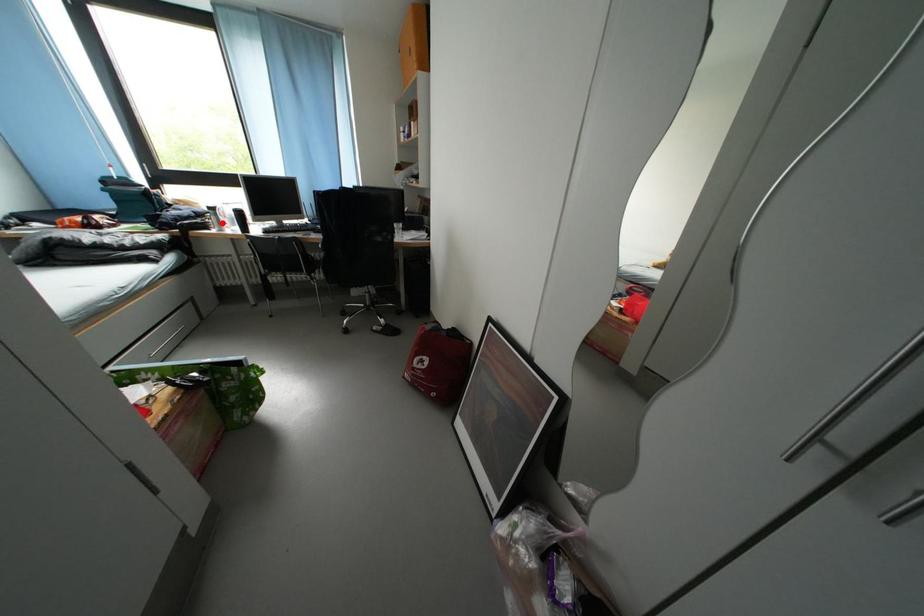
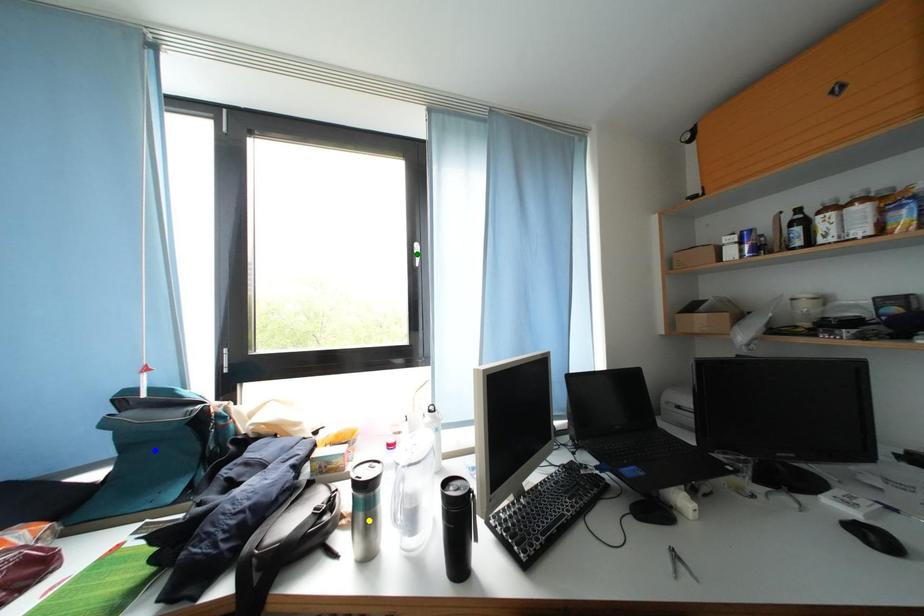
Question: I am providing you with two images of the same scene from different viewpoints. A red point is marked on the first image. You are given multiple points on the second image. Which point in image 2 represents the same 3d spot as the red point in image 1?

Choices:
 (A) green point
 (B) yellow point
 (C) blue point

Answer: (B)